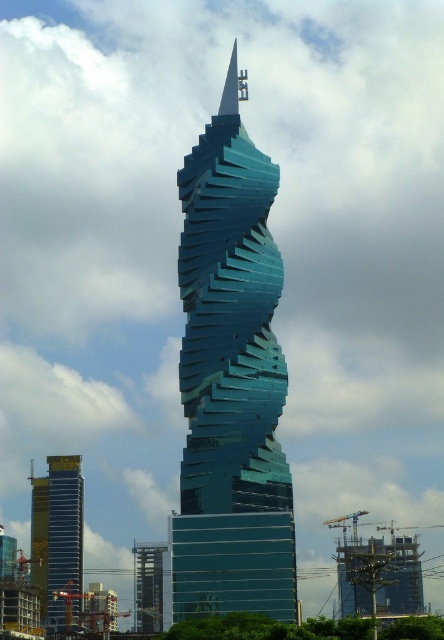
Question: Is glossy glass tower at center smaller than yellow glass building at left?

Choices:
 (A) no
 (B) yes

Answer: (A)

Question: Which point is closer to the camera?

Choices:
 (A) yellow glass building at left
 (B) glassy teal skyscraper at center
 (C) glossy glass tower at center

Answer: (C)

Question: Among these objects, which one is farthest from the camera?

Choices:
 (A) glassy teal skyscraper at center
 (B) glossy glass tower at center
 (C) yellow glass building at left

Answer: (C)

Question: Is glossy glass tower at center above yellow glass building at left?

Choices:
 (A) no
 (B) yes

Answer: (B)

Question: Is yellow glass building at left to the left of glassy teal skyscraper at center from the viewer's perspective?

Choices:
 (A) yes
 (B) no

Answer: (A)

Question: Which object is the farthest from the yellow glass building at left?

Choices:
 (A) glassy teal skyscraper at center
 (B) glossy glass tower at center

Answer: (B)